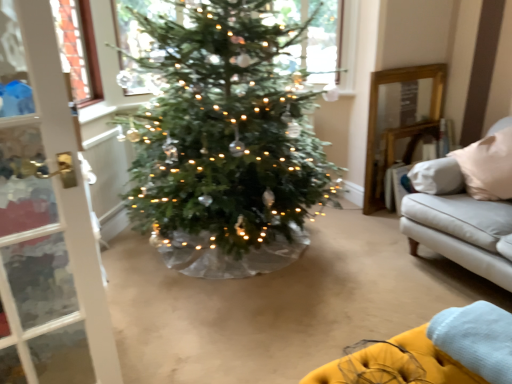
Question: Relative to clear glass window at upper center, is velvet yellow couch at lower right in front or behind?

Choices:
 (A) front
 (B) behind

Answer: (A)

Question: From a real-world perspective, is velvet yellow couch at lower right positioned above or below clear glass window at upper center?

Choices:
 (A) below
 (B) above

Answer: (A)

Question: Which is nearer to the yellow fabric blanket at lower right?

Choices:
 (A) clear glass window at upper center
 (B) velvet yellow couch at lower right

Answer: (B)

Question: Based on their relative distances, which object is nearer to the yellow fabric blanket at lower right?

Choices:
 (A) velvet yellow couch at lower right
 (B) clear glass window at upper center

Answer: (A)